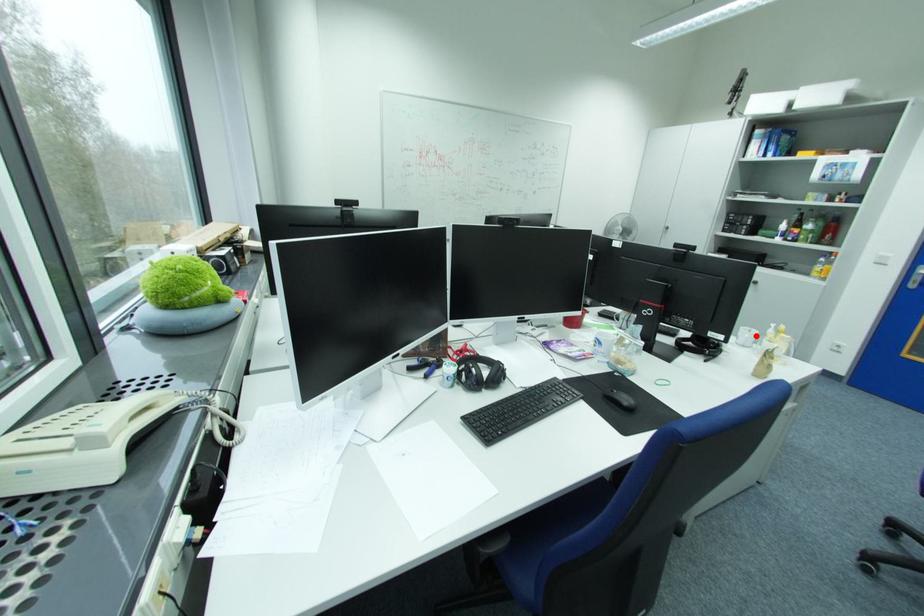
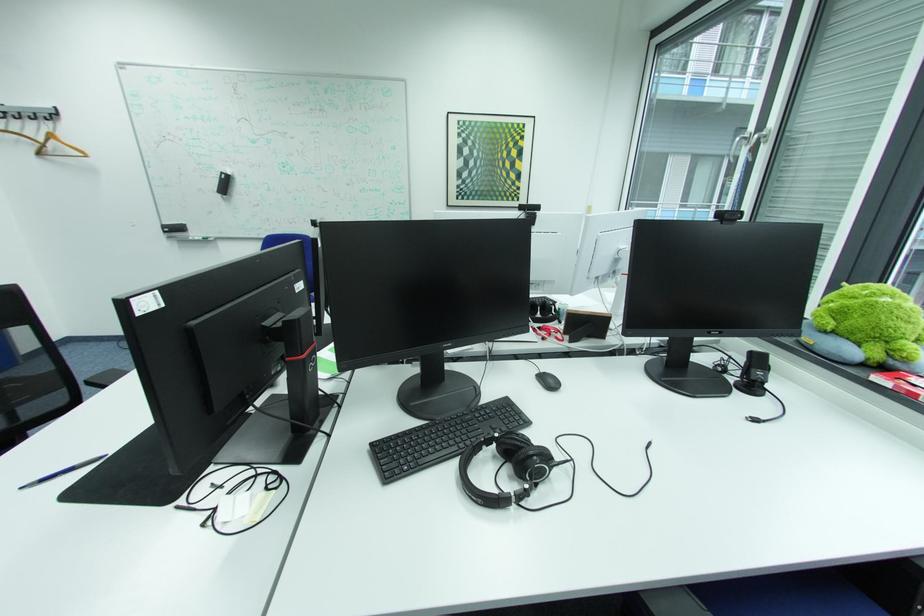
Question: I am providing you with two images of the same scene from different viewpoints. A red point is marked on the first image. Can you still see the location of the red point in image 2?

Choices:
 (A) Yes
 (B) No

Answer: (B)